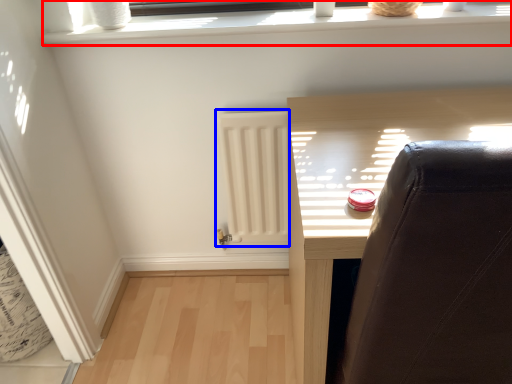
Question: Which of the following is the farthest to the observer, window frame (highlighted by a red box) or radiator (highlighted by a blue box)?

Choices:
 (A) window frame
 (B) radiator

Answer: (B)